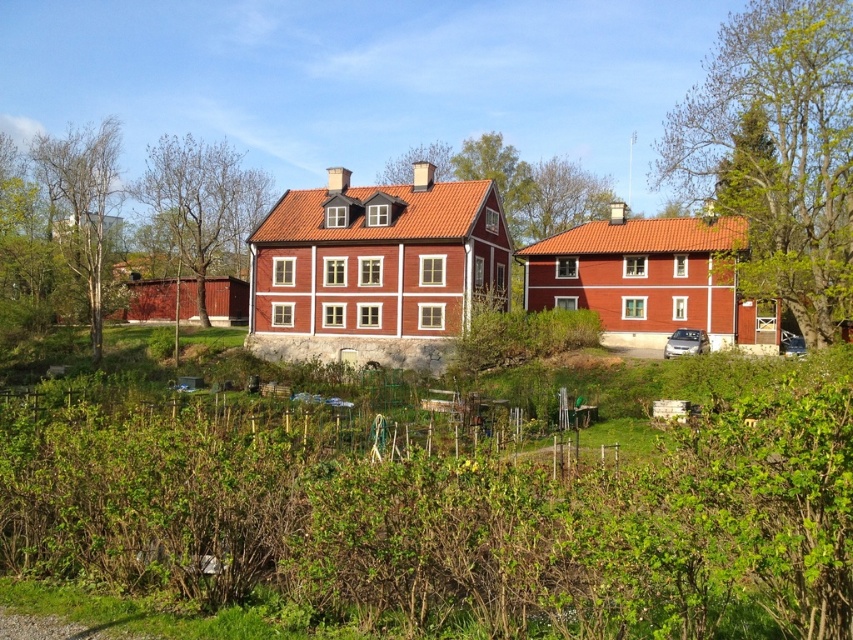
Measure the distance between bare wood tree at left and camera.

70.87 meters

Is bare wood tree at left further to camera compared to green leafy tree at center?

Yes, bare wood tree at left is behind green leafy tree at center.

Locate an element on the screen. bare wood tree at left is located at coordinates (202, 204).

Who is more distant from viewer, (778, 97) or (207, 312)?

The point (207, 312) is behind.

The height and width of the screenshot is (640, 853). What do you see at coordinates (776, 150) in the screenshot? I see `green leafy tree at upper right` at bounding box center [776, 150].

Where is `green leafy tree at upper right`? green leafy tree at upper right is located at coordinates (776, 150).

Which is above, green leafy tree at left or green leafy tree at center?

green leafy tree at center is higher up.

The width and height of the screenshot is (853, 640). I want to click on green leafy tree at left, so [82, 202].

Which is in front, point (115, 196) or point (421, 154)?

Positioned in front is point (115, 196).

The height and width of the screenshot is (640, 853). Identify the location of green leafy tree at left. (82, 202).